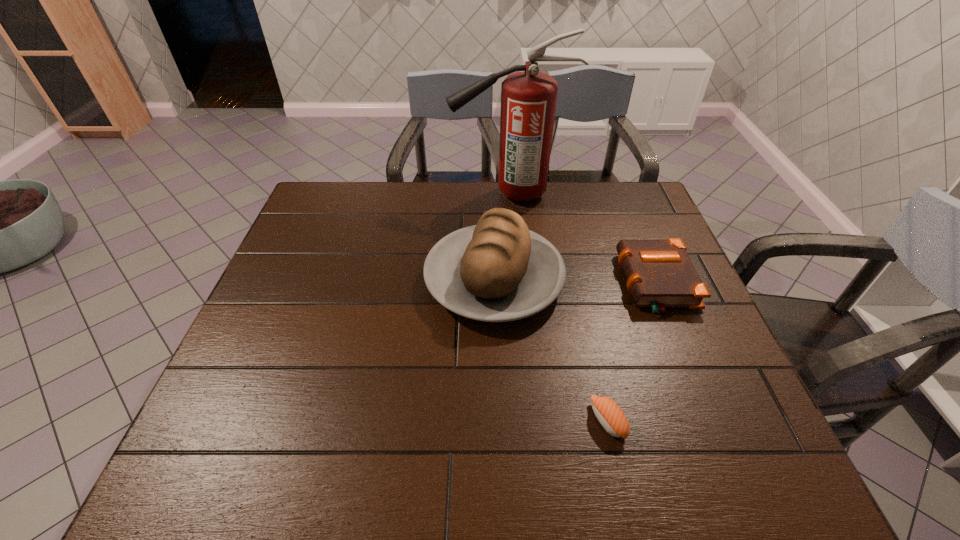
Locate an element on the screen. free space at the left edge is located at coordinates (324, 239).

The image size is (960, 540). I want to click on free space at the right edge of the desktop, so click(669, 322).

Find the location of a particular element. vacant point at the far right corner is located at coordinates (615, 218).

Locate an element on the screen. This screenshot has width=960, height=540. blank area at the near right corner is located at coordinates (732, 449).

Locate an element on the screen. Image resolution: width=960 pixels, height=540 pixels. free spot between the Bible and the nearest object is located at coordinates (632, 352).

The width and height of the screenshot is (960, 540). What are the coordinates of `free point between the shortest object and the bread` in the screenshot? It's located at tap(551, 350).

Locate an element on the screen. This screenshot has height=540, width=960. vacant area that lies between the Bible and the fire extinguisher is located at coordinates (583, 239).

I want to click on blank region between the bread and the Bible, so click(575, 282).

Find the location of a particular element. free space between the third shortest object and the Bible is located at coordinates (575, 282).

What are the coordinates of `vacant area that lies between the fire extinguisher and the sushi` in the screenshot? It's located at [559, 307].